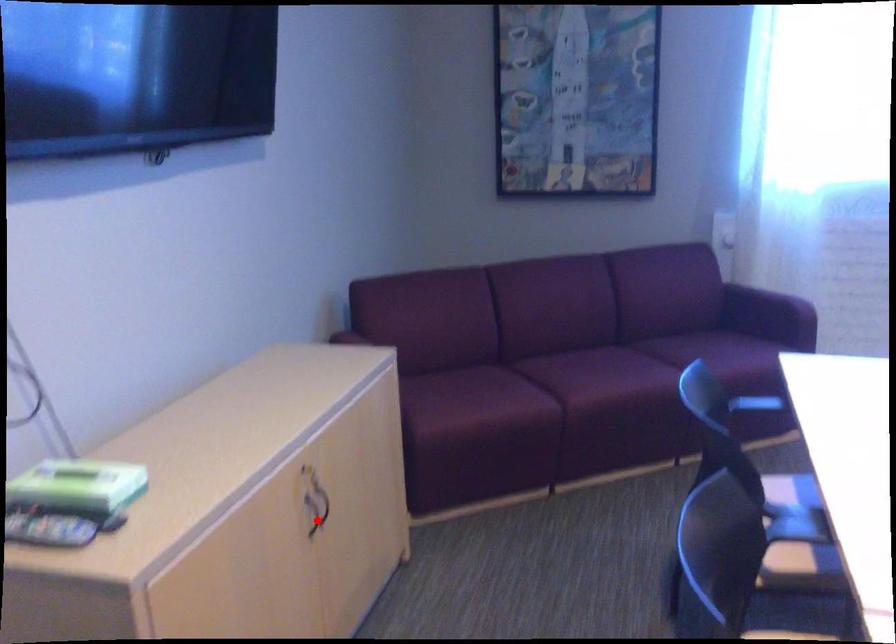
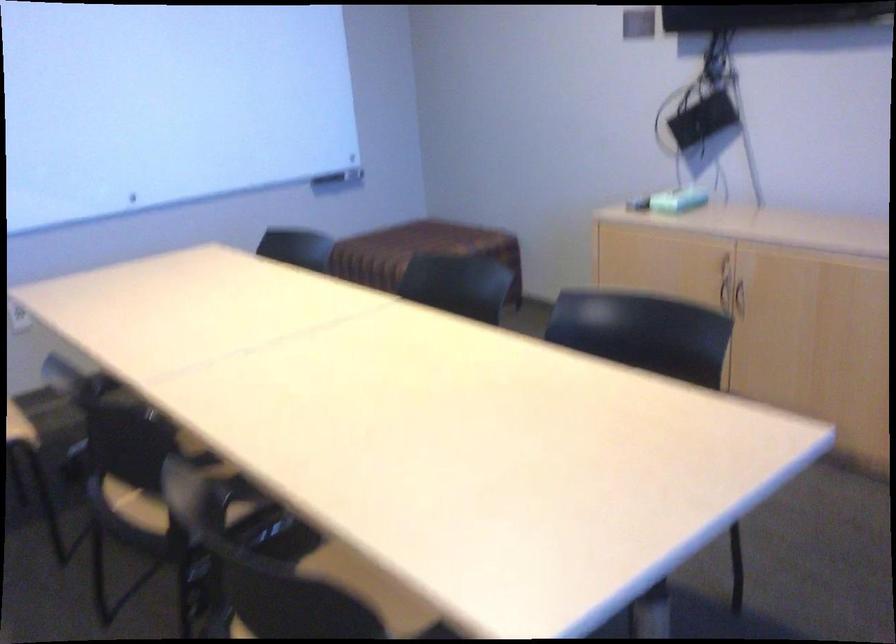
Question: I am providing you with two images of the same scene from different viewpoints. Given a red point in image1, look at the same physical point in image2. Is it:

Choices:
 (A) Closer to the viewpoint
 (B) Farther from the viewpoint

Answer: (B)